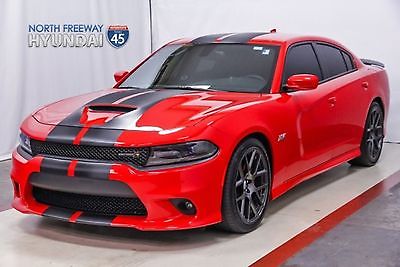
This screenshot has height=267, width=400. Find the location of `show floor`. show floor is located at coordinates (254, 237).